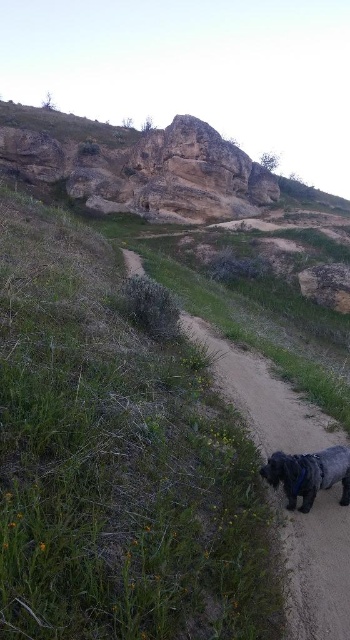
You are planning to hike along the dirt path at center and want to reach the rugged stone cliff at upper center. Based on the scene, what challenge might you face due to their height difference?

The rugged stone cliff at upper center is taller than the dirt path at center, so you might face a steep climb or elevation change when trying to reach it.

You are a hiker trying to locate the shiny black dog at lower right. According to the scene, is the rugged stone cliff at upper center blocking your view of the dog?

The shiny black dog at lower right is behind the rugged stone cliff at upper center, so the cliff is blocking your view of the dog.